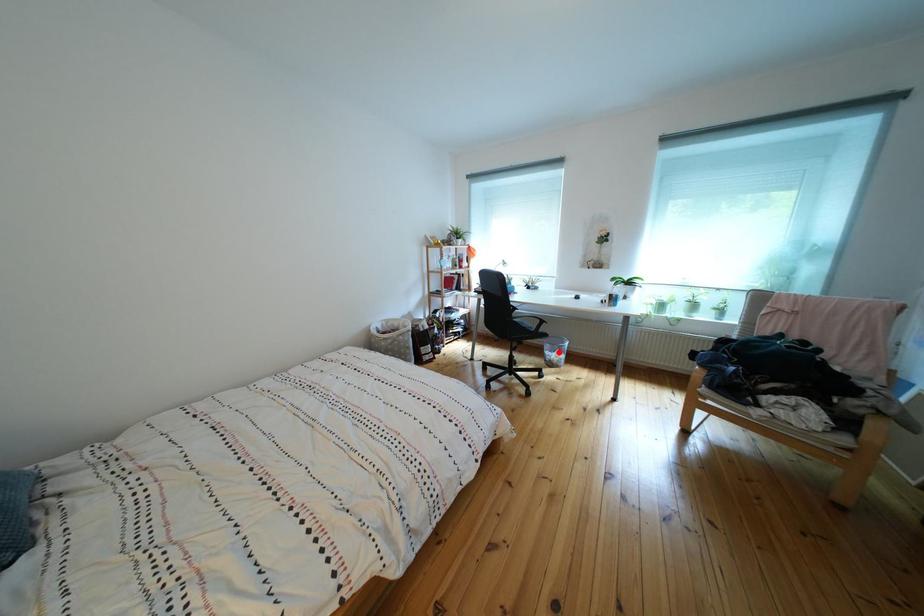
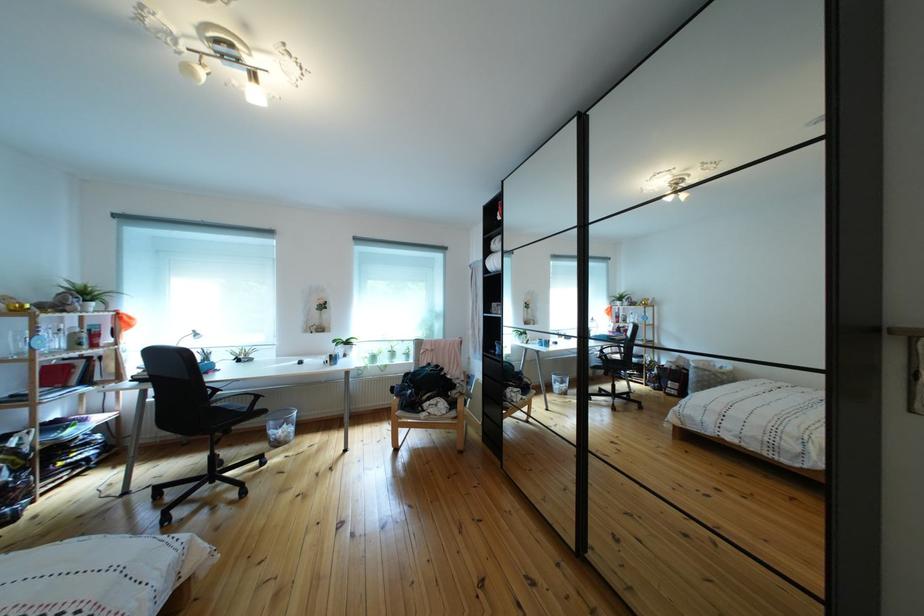
Find the pixel in the second image that matches the highlighted location in the first image.

(283, 430)